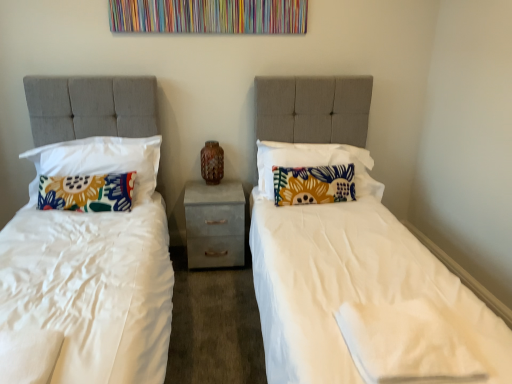
Question: In the image, is brown textured vase at center positioned in front of or behind floral fabric pillow at center, which is the first pillow in right-to-left order?

Choices:
 (A) behind
 (B) front

Answer: (A)

Question: Considering the positions of point (212, 157) and point (358, 178), is point (212, 157) closer or farther from the camera than point (358, 178)?

Choices:
 (A) farther
 (B) closer

Answer: (B)

Question: Estimate the real-world distances between objects in this image. Which object is farther from the brown textured vase at center?

Choices:
 (A) floral fabric pillow at center, which is the second pillow in right-to-left order
 (B) floral fabric pillow at left, arranged as the third pillow when viewed from the right
 (C) metallic gray nightstand at center
 (D) floral fabric pillow at center, acting as the 4th pillow starting from the left
 (E) floral fabric pillow at left, marked as the first pillow in a left-to-right arrangement

Answer: (E)

Question: Which object is positioned farthest from the floral fabric pillow at left, which is counted as the 4th pillow, starting from the right?

Choices:
 (A) metallic gray nightstand at center
 (B) brown textured vase at center
 (C) floral fabric pillow at left, arranged as the third pillow when viewed from the right
 (D) floral fabric pillow at center, which is the third pillow in left-to-right order
 (E) floral fabric pillow at center, which is the first pillow in right-to-left order

Answer: (D)